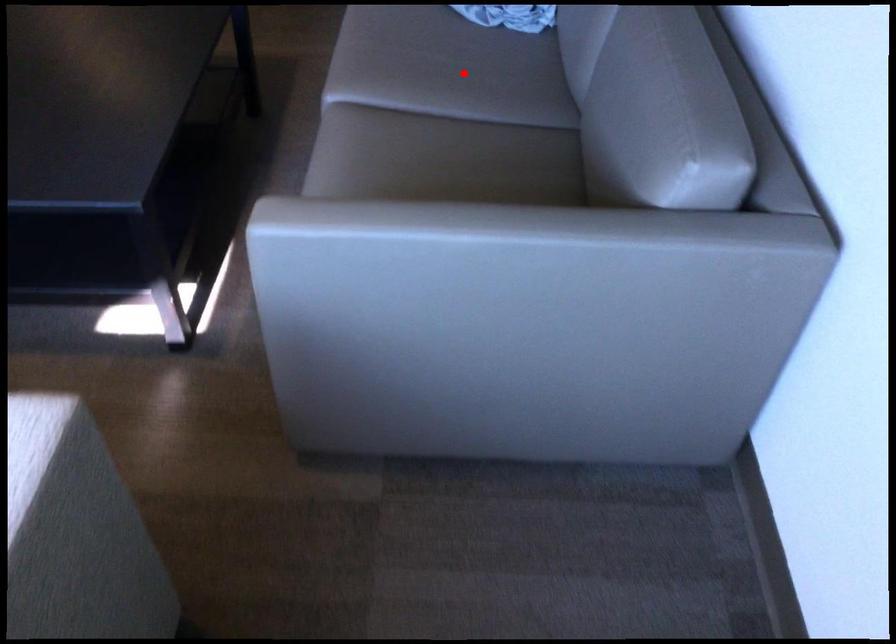
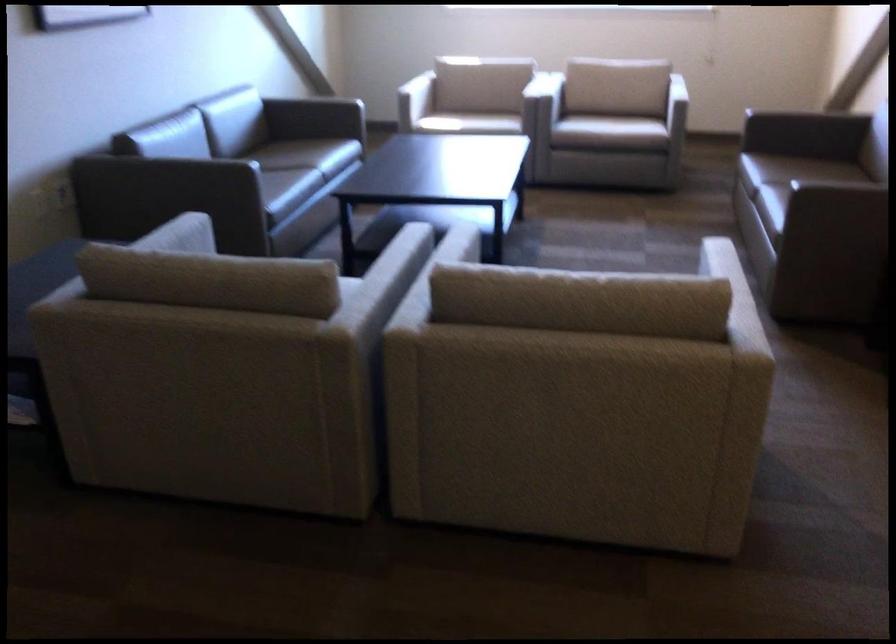
Question: I am providing you with two images of the same scene from different viewpoints. A red point is marked on the first image. Is the red point's position out of view in image 2?

Choices:
 (A) Yes
 (B) No

Answer: (A)